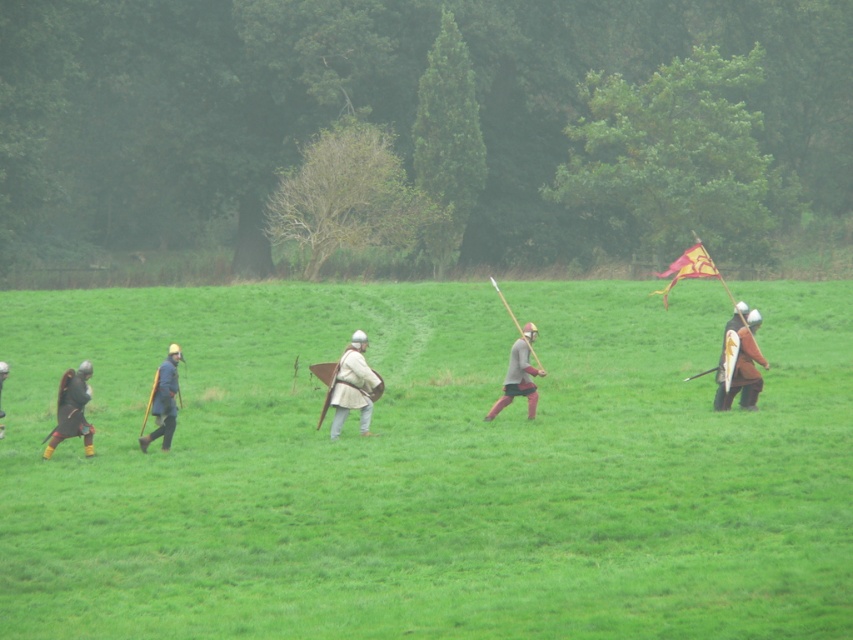
Is green grass field at center below dark brown leather armor at left?

No.

Does point (759, 344) come farther from viewer compared to point (67, 426)?

Yes, point (759, 344) is farther from viewer.

Where is `green grass field at center`? green grass field at center is located at coordinates (428, 467).

Who is lower down, brown leather armor at center or matte black armor at left?

brown leather armor at center is lower down.

Does brown leather armor at center appear on the right side of matte black armor at left?

Correct, you'll find brown leather armor at center to the right of matte black armor at left.

Is point (509, 365) in front of point (1, 365)?

No, (509, 365) is further to viewer.

Where is `brown leather armor at center`? The height and width of the screenshot is (640, 853). brown leather armor at center is located at coordinates (519, 374).

Between dark brown leather armor at left and brown leather armor at center, which one appears on the right side from the viewer's perspective?

Positioned to the right is brown leather armor at center.

Looking at this image, is dark brown leather armor at left to the left of brown leather armor at center from the viewer's perspective?

Indeed, dark brown leather armor at left is positioned on the left side of brown leather armor at center.

Between point (86, 396) and point (506, 401), which one is positioned behind?

The point (506, 401) is more distant.

This screenshot has width=853, height=640. I want to click on dark brown leather armor at left, so click(73, 410).